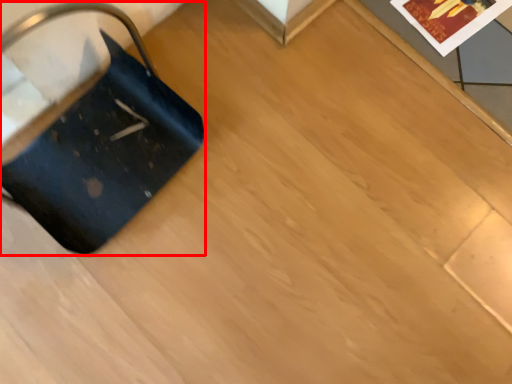
Question: From the image's perspective, what is the correct spatial relationship of luggage (annotated by the red box) in relation to postcard?

Choices:
 (A) above
 (B) below

Answer: (B)